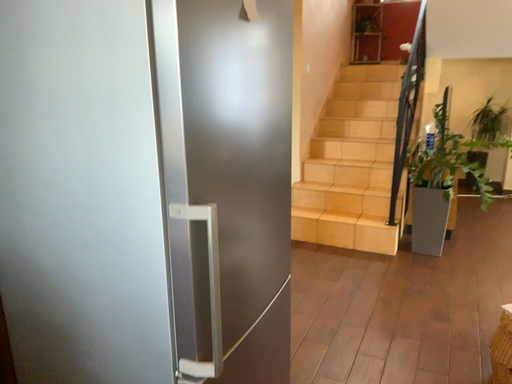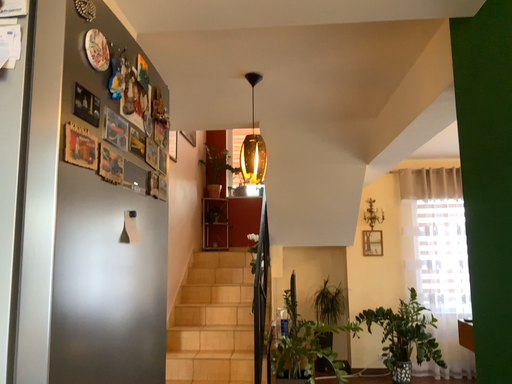
Question: How did the camera likely rotate when shooting the video?

Choices:
 (A) rotated downward
 (B) rotated upward

Answer: (B)